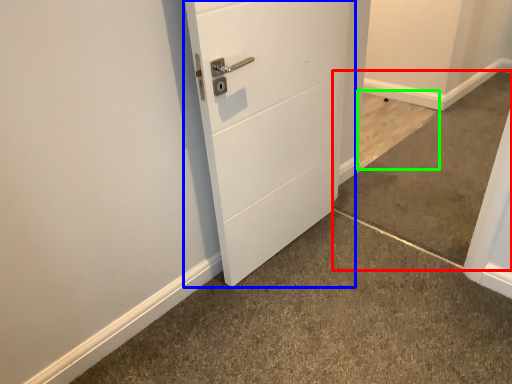
Question: Estimate the real-world distances between objects in this image. Which object is closer to concrete (highlighted by a red box), door (highlighted by a blue box) or concrete (highlighted by a green box)?

Choices:
 (A) door
 (B) concrete

Answer: (B)